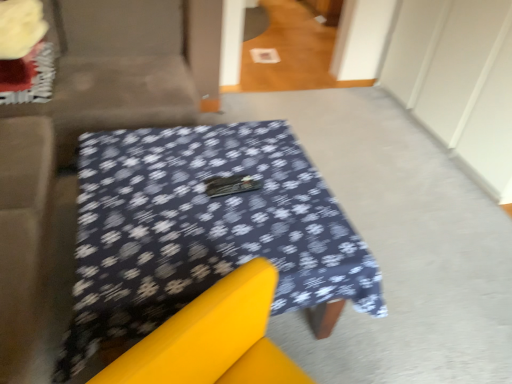
Measure the distance between point (32, 37) and camera.

Point (32, 37) and camera are 2.33 meters apart from each other.

At what (x,y) coordinates should I click in order to perform the action: click on fluffy yellow flower at upper left. Please return your answer as a coordinate pair (x, y). Looking at the image, I should click on (20, 27).

From a real-world perspective, does fluffy yellow flower at upper left sit lower than dark blue fabric-covered table at center?

No, from a real-world perspective, fluffy yellow flower at upper left is not beneath dark blue fabric-covered table at center.

Relative to dark blue fabric-covered table at center, is fluffy yellow flower at upper left in front or behind?

Visually, fluffy yellow flower at upper left is located behind dark blue fabric-covered table at center.

Is fluffy yellow flower at upper left oriented away from dark blue fabric-covered table at center?

No.

Considering the sizes of fluffy yellow flower at upper left and velvet beige couch at upper left in the image, is fluffy yellow flower at upper left bigger or smaller than velvet beige couch at upper left?

fluffy yellow flower at upper left is smaller than velvet beige couch at upper left.

Between fluffy yellow flower at upper left and velvet beige couch at upper left, which one is positioned behind?

fluffy yellow flower at upper left is further away from the camera.

From a real-world perspective, who is located lower, fluffy yellow flower at upper left or velvet beige couch at upper left?

velvet beige couch at upper left.

Considering the sizes of objects fluffy yellow flower at upper left and velvet beige couch at upper left in the image provided, who is thinner, fluffy yellow flower at upper left or velvet beige couch at upper left?

fluffy yellow flower at upper left is thinner.

Does dark blue fabric-covered table at center turn towards fluffy yellow flower at upper left?

No.

Considering the sizes of objects dark blue fabric-covered table at center and fluffy yellow flower at upper left in the image provided, who is wider, dark blue fabric-covered table at center or fluffy yellow flower at upper left?

Wider between the two is dark blue fabric-covered table at center.

Is the surface of dark blue fabric-covered table at center in direct contact with fluffy yellow flower at upper left?

No.

From a real-world perspective, between velvet beige couch at upper left and dark blue fabric-covered table at center, who is vertically lower?

dark blue fabric-covered table at center.

Between point (87, 84) and point (106, 266), which one is positioned in front?

The point (106, 266) is more forward.

From the image's perspective, which one is positioned lower, velvet beige couch at upper left or dark blue fabric-covered table at center?

dark blue fabric-covered table at center.

Consider the image. Considering the sizes of velvet beige couch at upper left and fluffy yellow flower at upper left in the image, is velvet beige couch at upper left taller or shorter than fluffy yellow flower at upper left?

In the image, velvet beige couch at upper left appears to be taller than fluffy yellow flower at upper left.

Is the depth of velvet beige couch at upper left less than that of fluffy yellow flower at upper left?

Yes, velvet beige couch at upper left is closer to the camera.

Is velvet beige couch at upper left aimed at fluffy yellow flower at upper left?

Yes, velvet beige couch at upper left is aimed at fluffy yellow flower at upper left.

How different are the orientations of velvet beige couch at upper left and fluffy yellow flower at upper left in degrees?

velvet beige couch at upper left and fluffy yellow flower at upper left are facing 92.7 degrees away from each other.

Is dark blue fabric-covered table at center oriented towards velvet beige couch at upper left?

No.

Consider the image. Which of these two, dark blue fabric-covered table at center or velvet beige couch at upper left, is thinner?

velvet beige couch at upper left.

From a real-world perspective, does dark blue fabric-covered table at center stand above velvet beige couch at upper left?

No, from a real-world perspective, dark blue fabric-covered table at center is not above velvet beige couch at upper left.

You are a GUI agent. You are given a task and a screenshot of the screen. Output one action in this format:
    pyautogui.click(x=<x>, y=<y>)
    Task: Click on the table on the right of fluffy yellow flower at upper left
    
    Given the screenshot: What is the action you would take?
    pyautogui.click(x=202, y=229)

Image resolution: width=512 pixels, height=384 pixels. In the image, there is a fluffy yellow flower at upper left. In order to click on couch below it (from a real-world perspective) in this screenshot , I will do 128,66.

From the image, which object appears to be farther from velvet beige couch at upper left, dark blue fabric-covered table at center or fluffy yellow flower at upper left?

Among the two, dark blue fabric-covered table at center is located further to velvet beige couch at upper left.

Considering their positions, is fluffy yellow flower at upper left positioned further to dark blue fabric-covered table at center than velvet beige couch at upper left?

Among the two, fluffy yellow flower at upper left is located further to dark blue fabric-covered table at center.

Based on their spatial positions, is velvet beige couch at upper left or dark blue fabric-covered table at center closer to fluffy yellow flower at upper left?

velvet beige couch at upper left.

When comparing their distances from velvet beige couch at upper left, does fluffy yellow flower at upper left or dark blue fabric-covered table at center seem closer?

fluffy yellow flower at upper left is closer to velvet beige couch at upper left.

Which object lies nearer to the anchor point fluffy yellow flower at upper left, dark blue fabric-covered table at center or velvet beige couch at upper left?

velvet beige couch at upper left is closer to fluffy yellow flower at upper left.

Looking at the image, which one is located further to dark blue fabric-covered table at center, velvet beige couch at upper left or fluffy yellow flower at upper left?

The object further to dark blue fabric-covered table at center is fluffy yellow flower at upper left.

Identify the location of couch situated between fluffy yellow flower at upper left and dark blue fabric-covered table at center from left to right. This screenshot has height=384, width=512. click(128, 66).